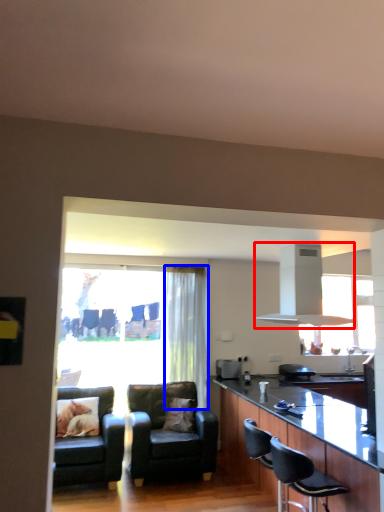
Question: Which point is closer to the camera, exhaust hood (highlighted by a red box) or curtain (highlighted by a blue box)?

Choices:
 (A) exhaust hood
 (B) curtain

Answer: (A)